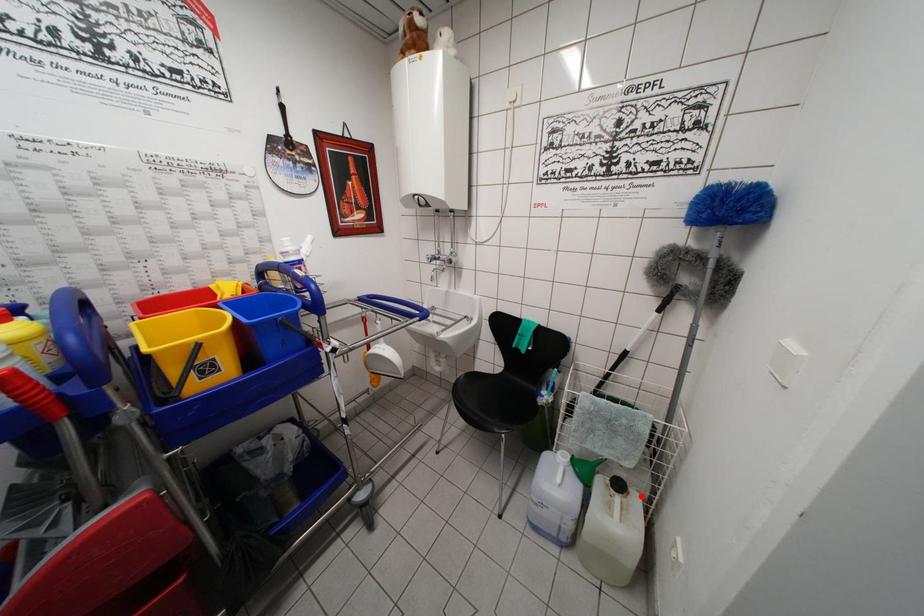
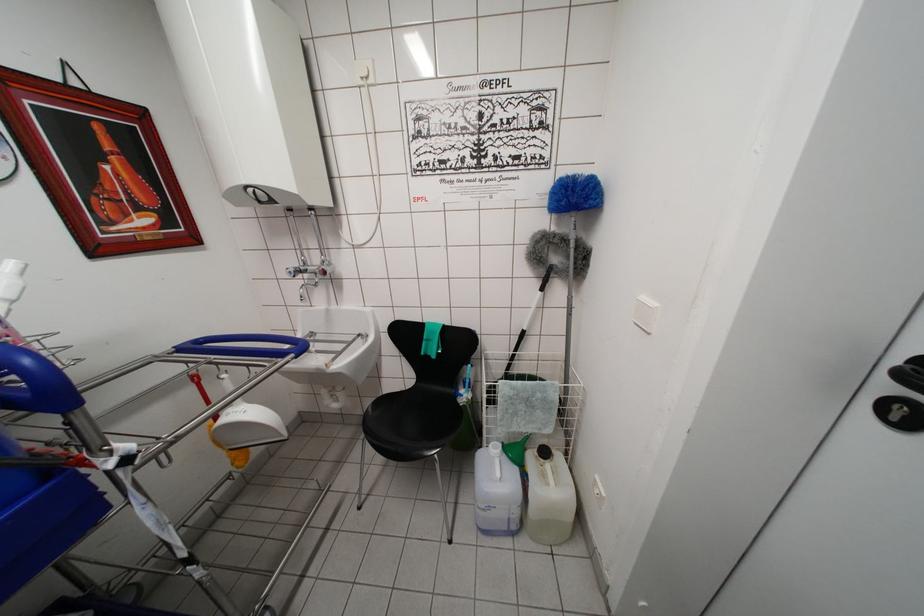
In the second image, find the point that corresponds to the highlighted location in the first image.

(561, 455)